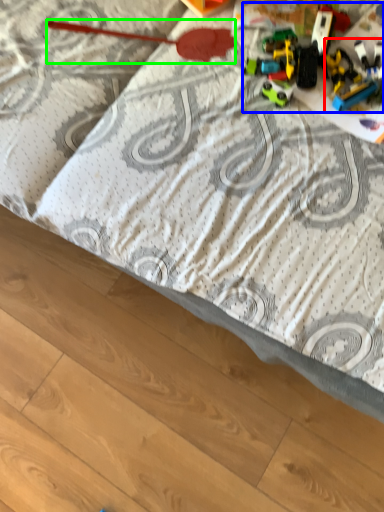
Question: Which object is positioned farthest from toy (highlighted by a red box)? Select from toy (highlighted by a blue box) and toy (highlighted by a green box).

Choices:
 (A) toy
 (B) toy

Answer: (B)